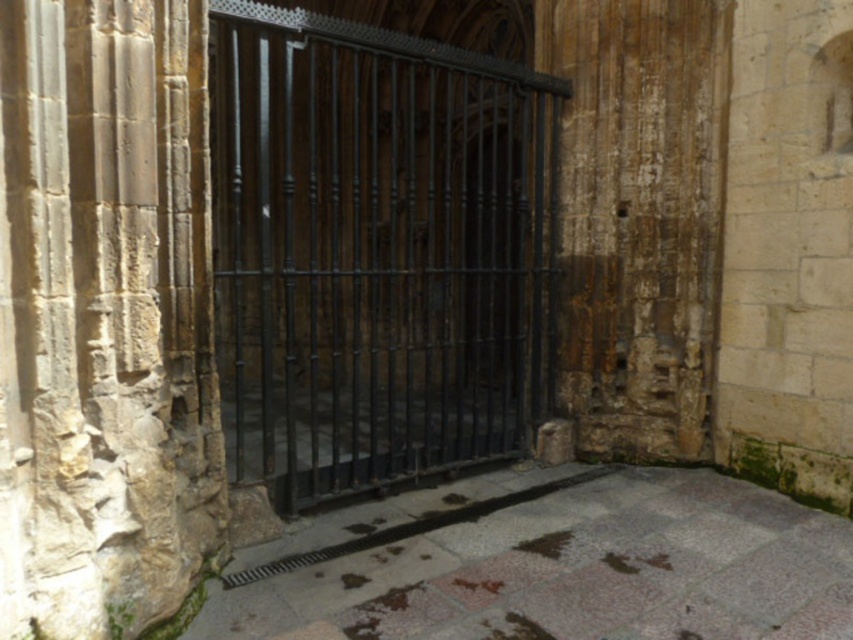
Does black wrought iron gate at center appear on the left side of stone textured pillar at center?

Yes, black wrought iron gate at center is to the left of stone textured pillar at center.

Looking at this image, is black wrought iron gate at center positioned at the back of stone textured pillar at center?

Yes, black wrought iron gate at center is further from the viewer.

Which is in front, point (344, 292) or point (169, 326)?

Point (169, 326) is more forward.

This screenshot has width=853, height=640. I want to click on black wrought iron gate at center, so click(x=375, y=252).